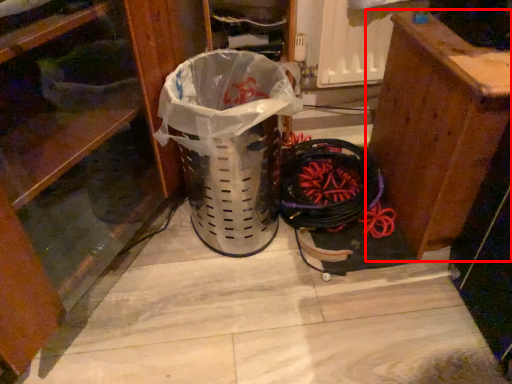
Question: Considering the relative positions of furniture (annotated by the red box) and dresser in the image provided, where is furniture (annotated by the red box) located with respect to the staircase?

Choices:
 (A) left
 (B) right

Answer: (B)